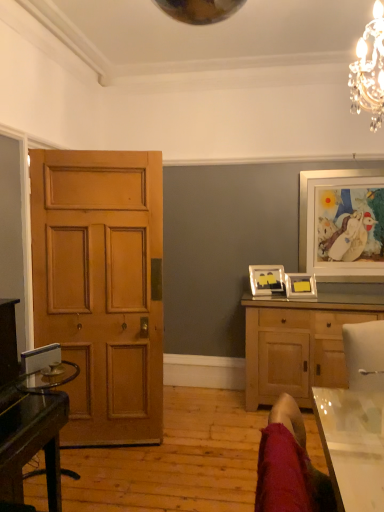
Question: Is transparent glass table at lower right at the back of matte black picture frame at center-right, acting as the third picture frame starting from the right?

Choices:
 (A) no
 (B) yes

Answer: (A)

Question: Considering the relative sizes of matte black picture frame at center-right, which is the first picture frame in left-to-right order, and transparent glass table at lower right in the image provided, is matte black picture frame at center-right, which is the first picture frame in left-to-right order, shorter than transparent glass table at lower right?

Choices:
 (A) yes
 (B) no

Answer: (A)

Question: Is matte black picture frame at center-right, which is the first picture frame in left-to-right order, thinner than transparent glass table at lower right?

Choices:
 (A) no
 (B) yes

Answer: (B)

Question: From a real-world perspective, does matte black picture frame at center-right, which is the first picture frame in left-to-right order, sit lower than transparent glass table at lower right?

Choices:
 (A) yes
 (B) no

Answer: (B)

Question: Is matte black picture frame at center-right, which is the first picture frame in left-to-right order, wider than transparent glass table at lower right?

Choices:
 (A) yes
 (B) no

Answer: (B)

Question: Does matte black picture frame at center-right, which is the first picture frame in left-to-right order, have a larger size compared to transparent glass table at lower right?

Choices:
 (A) no
 (B) yes

Answer: (A)

Question: Considering the relative sizes of matte black picture frame at center-right, which is the first picture frame in left-to-right order, and white glossy picture frame at upper right, the third picture frame viewed from the left, in the image provided, is matte black picture frame at center-right, which is the first picture frame in left-to-right order, taller than white glossy picture frame at upper right, the third picture frame viewed from the left,?

Choices:
 (A) no
 (B) yes

Answer: (A)

Question: Does matte black picture frame at center-right, acting as the third picture frame starting from the right, turn towards white glossy picture frame at upper right, the third picture frame viewed from the left?

Choices:
 (A) no
 (B) yes

Answer: (A)

Question: Would you say matte black picture frame at center-right, which is the first picture frame in left-to-right order, contains white glossy picture frame at upper right, the third picture frame viewed from the left?

Choices:
 (A) no
 (B) yes

Answer: (A)

Question: Is matte black picture frame at center-right, acting as the third picture frame starting from the right, directly adjacent to white glossy picture frame at upper right, the third picture frame viewed from the left?

Choices:
 (A) yes
 (B) no

Answer: (B)

Question: Does matte black picture frame at center-right, which is the first picture frame in left-to-right order, appear on the left side of white glossy picture frame at upper right, the third picture frame viewed from the left?

Choices:
 (A) no
 (B) yes

Answer: (B)

Question: Is matte black picture frame at center-right, which is the first picture frame in left-to-right order, thinner than white glossy picture frame at upper right, the third picture frame viewed from the left?

Choices:
 (A) yes
 (B) no

Answer: (B)

Question: From a real-world perspective, is white glossy picture frame at upper right, placed as the 1th picture frame when sorted from right to left, beneath velvet red swivel chair at lower right?

Choices:
 (A) yes
 (B) no

Answer: (B)